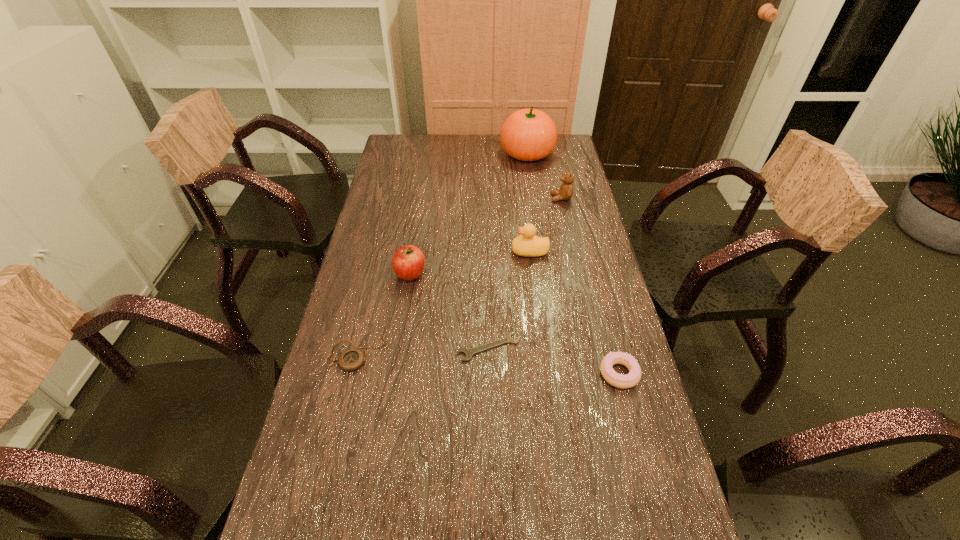
Identify the location of free space located 0.060m on the face of the teddy bear. Image resolution: width=960 pixels, height=540 pixels. (535, 198).

Where is `free space located on the face of the teddy bear`? Image resolution: width=960 pixels, height=540 pixels. free space located on the face of the teddy bear is located at coordinates (x=490, y=198).

The image size is (960, 540). I want to click on free location located 0.160m on the face of the third farthest object, so (x=463, y=251).

Locate an element on the screen. The image size is (960, 540). free spot located on the face of the third farthest object is located at coordinates (435, 251).

Locate an element on the screen. The width and height of the screenshot is (960, 540). vacant region located 0.300m on the face of the third farthest object is located at coordinates (420, 251).

At what (x,y) coordinates should I click in order to perform the action: click on vacant space located on the right of the apple. Please return your answer as a coordinate pair (x, y). Looking at the image, I should click on (526, 274).

This screenshot has height=540, width=960. What are the coordinates of `vacant space located on the front of the doughnut` in the screenshot? It's located at (648, 485).

Locate an element on the screen. vacant space located on the back of the sixth tallest object is located at coordinates (377, 266).

This screenshot has height=540, width=960. In order to click on vacant space located on the front of the shortest object in this screenshot , I will do `click(491, 473)`.

Where is `object that is at the far edge`? This screenshot has height=540, width=960. object that is at the far edge is located at coordinates (529, 134).